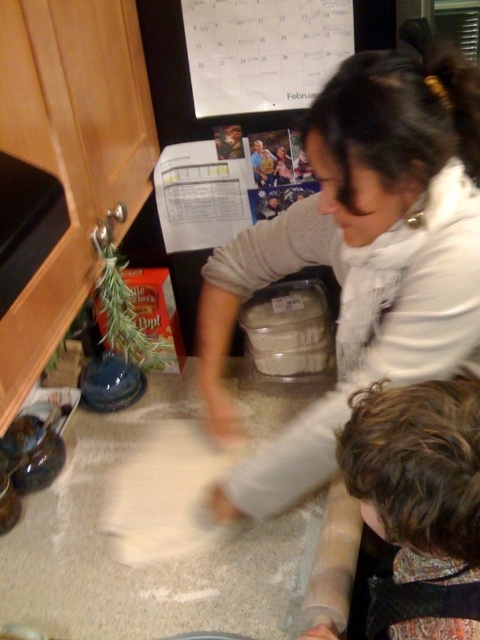
You are standing in the kitchen and want to reach an object located at point A and another at point B. The coordinates for point A are (206,275) and for point B are (288,10). Based on the scene description, which point is closer to you?

Point A at (206,275) is closer to you than point B at (288,10) because it is further to the camera according to the spatial description provided.

Based on the scene description, where exactly is the curly brown hair at lower right located in terms of coordinates?

The curly brown hair at lower right is located at point (x=419, y=502).

In the scene shown: You are standing in the kitchen and want to place a small bowl between the white textured sweater at upper center and the white paper calendar at upper center. Can you fit it there?

The white textured sweater at upper center is closer to the viewer than the white paper calendar at upper center, so there is space between them for the small bowl.